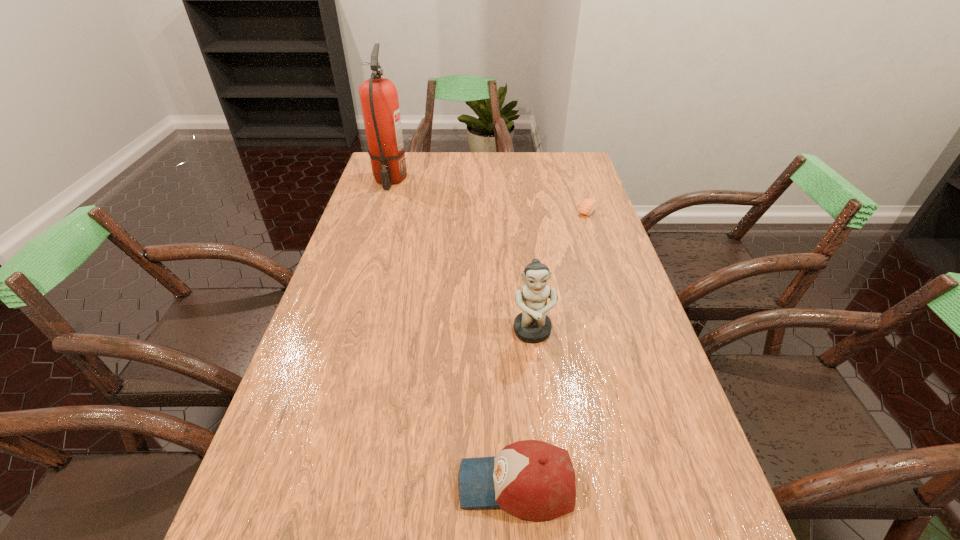
Identify the location of free spot between the farthest object and the nearest object. The width and height of the screenshot is (960, 540). (453, 332).

This screenshot has width=960, height=540. What are the coordinates of `object that is the closest to the farthest object` in the screenshot? It's located at (588, 205).

Select which object appears as the closest to the farthest object. Please provide its 2D coordinates. Your answer should be formatted as a tuple, i.e. [(x, y)], where the tuple contains the x and y coordinates of a point satisfying the conditions above.

[(588, 205)]

Identify the location of free region that satisfies the following two spatial constraints: 1. on the nozzle of the rightmost object; 2. on the right side of the leftmost object. Image resolution: width=960 pixels, height=540 pixels. (380, 211).

Find the location of a particular element. vacant position in the image that satisfies the following two spatial constraints: 1. on the front side of the sushi; 2. on the front-facing side of the baseball cap is located at coordinates (679, 484).

Image resolution: width=960 pixels, height=540 pixels. Identify the location of free space that satisfies the following two spatial constraints: 1. on the front-facing side of the figurine; 2. on the front-facing side of the baseball cap. (551, 484).

At what (x,y) coordinates should I click in order to perform the action: click on vacant space that satisfies the following two spatial constraints: 1. on the front-facing side of the figurine; 2. on the front-facing side of the second shortest object. Please return your answer as a coordinate pair (x, y). This screenshot has width=960, height=540. Looking at the image, I should click on (551, 484).

Locate an element on the screen. Image resolution: width=960 pixels, height=540 pixels. vacant area that satisfies the following two spatial constraints: 1. on the nozzle of the fire extinguisher; 2. on the left side of the rightmost object is located at coordinates (380, 211).